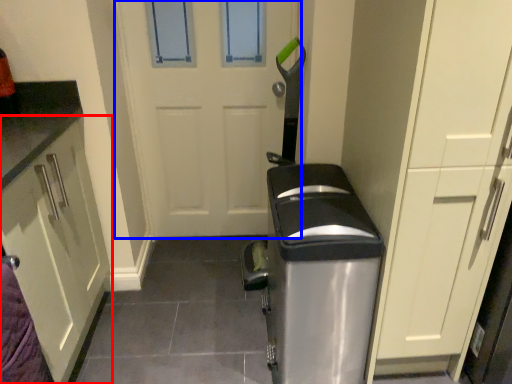
Question: Which point is further to the camera, cabinetry (highlighted by a red box) or door (highlighted by a blue box)?

Choices:
 (A) cabinetry
 (B) door

Answer: (B)